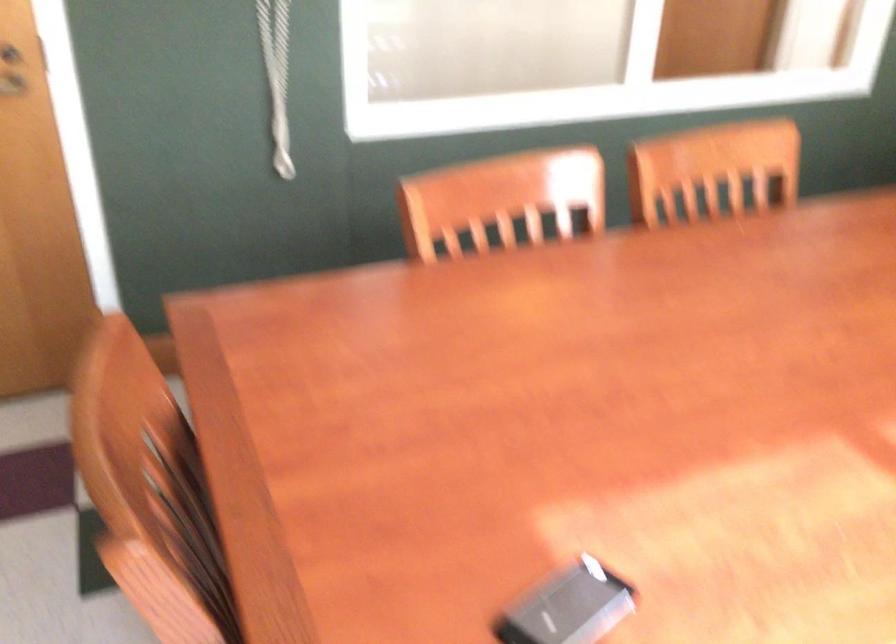
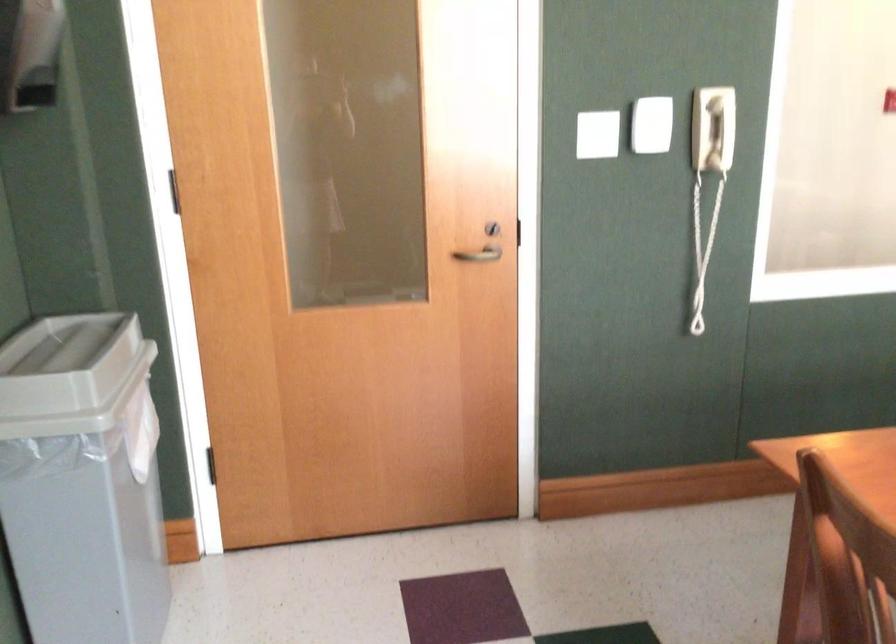
The images are taken continuously from a first-person perspective. In which direction are you moving?

The movement direction of the cameraman is left, backward.